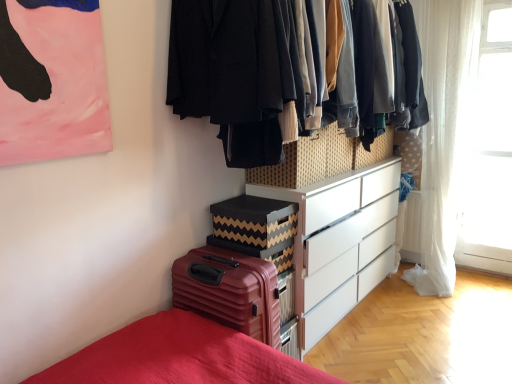
Locate an element on the screen. woven fabric drawer at center is located at coordinates (321, 158).

Find the location of `woven fabric drawer at center`. woven fabric drawer at center is located at coordinates (321, 158).

Which object is wider, textured fabric clothes at upper center or white matte chest of drawers at center?

textured fabric clothes at upper center.

Is textured fabric clothes at upper center next to white matte chest of drawers at center and touching it?

No, textured fabric clothes at upper center is not in contact with white matte chest of drawers at center.

How distant is textured fabric clothes at upper center from white matte chest of drawers at center?

A distance of 35.13 inches exists between textured fabric clothes at upper center and white matte chest of drawers at center.

Is white sheer curtain at right facing towards matte brown suitcase at lower left?

Yes, white sheer curtain at right is facing matte brown suitcase at lower left.

Does white sheer curtain at right have a smaller size compared to matte brown suitcase at lower left?

Incorrect, white sheer curtain at right is not smaller in size than matte brown suitcase at lower left.

Is white sheer curtain at right outside of matte brown suitcase at lower left?

Yes, white sheer curtain at right is located beyond the bounds of matte brown suitcase at lower left.

Who is taller, white sheer curtain at right or matte brown suitcase at lower left?

white sheer curtain at right.

Does point (271, 78) come behind point (446, 243)?

That is False.

Locate an element on the screen. The height and width of the screenshot is (384, 512). closet in front of the white sheer curtain at right is located at coordinates (234, 73).

How far apart are textured fabric clothes at upper center and white sheer curtain at right?

1.85 meters.

Which is in front, textured fabric clothes at upper center or white sheer curtain at right?

textured fabric clothes at upper center.

Looking at this image, from the image's perspective, which one is positioned higher, textured fabric clothes at upper center or white sheer curtain at right?

textured fabric clothes at upper center is shown above in the image.

In the scene shown: How many degrees apart are the facing directions of textured fabric clothes at upper center and white sheer curtain at right?

textured fabric clothes at upper center and white sheer curtain at right are facing 89.3 degrees away from each other.

Based on the photo, is textured fabric clothes at upper center oriented away from white sheer curtain at right?

No, white sheer curtain at right is not at the back of textured fabric clothes at upper center.

Is textured fabric clothes at upper center with woven fabric drawer at center?

There is a gap between textured fabric clothes at upper center and woven fabric drawer at center.

Identify the location of cabinetry directly beneath the textured fabric clothes at upper center (from a real-world perspective). (321, 158).

Considering the sizes of textured fabric clothes at upper center and woven fabric drawer at center in the image, is textured fabric clothes at upper center taller or shorter than woven fabric drawer at center?

In the image, textured fabric clothes at upper center appears to be taller than woven fabric drawer at center.

Would you say textured fabric clothes at upper center is outside woven fabric drawer at center?

Absolutely, textured fabric clothes at upper center is external to woven fabric drawer at center.

From the picture: Can you confirm if matte brown suitcase at lower left is positioned to the right of white matte chest of drawers at center?

Incorrect, matte brown suitcase at lower left is not on the right side of white matte chest of drawers at center.

In order to click on suitcase in front of the white matte chest of drawers at center in this screenshot , I will do 229,291.

Is matte brown suitcase at lower left positioned with its back to white matte chest of drawers at center?

That's not correct — matte brown suitcase at lower left is not looking away from white matte chest of drawers at center.

Which object is thinner, matte brown suitcase at lower left or white matte chest of drawers at center?

With smaller width is white matte chest of drawers at center.

Do you think matte brown suitcase at lower left is within white sheer curtain at right, or outside of it?

matte brown suitcase at lower left is outside white sheer curtain at right.

Which of these two, matte brown suitcase at lower left or white sheer curtain at right, stands taller?

white sheer curtain at right is taller.

From the image's perspective, is matte brown suitcase at lower left positioned above or below white sheer curtain at right?

Clearly, from the image's perspective, matte brown suitcase at lower left is below white sheer curtain at right.

Where is `closet above the white matte chest of drawers at center (from a real-world perspective)`? The width and height of the screenshot is (512, 384). closet above the white matte chest of drawers at center (from a real-world perspective) is located at coordinates (234, 73).

Identify the location of suitcase in front of the white sheer curtain at right. This screenshot has height=384, width=512. (229, 291).

When comparing their distances from white matte chest of drawers at center, does woven fabric drawer at center or white sheer curtain at right seem closer?

woven fabric drawer at center.

When comparing their distances from white sheer curtain at right, does woven fabric drawer at center or white sheer curtain at right seem closer?

white sheer curtain at right is positioned closer to the anchor white sheer curtain at right.

Looking at the image, which one is located closer to textured fabric clothes at upper center, woven fabric drawer at center or white matte chest of drawers at center?

woven fabric drawer at center.

Based on their spatial positions, is white sheer curtain at right or matte brown suitcase at lower left further from white sheer curtain at right?

matte brown suitcase at lower left is positioned further to the anchor white sheer curtain at right.

Which object lies further to the anchor point woven fabric drawer at center, matte brown suitcase at lower left or white sheer curtain at right?

Based on the image, white sheer curtain at right appears to be further to woven fabric drawer at center.

Based on their spatial positions, is textured fabric clothes at upper center or matte brown suitcase at lower left closer to white sheer curtain at right?

Based on the image, textured fabric clothes at upper center appears to be nearer to white sheer curtain at right.

Looking at the image, which one is located closer to white matte chest of drawers at center, white sheer curtain at right or matte brown suitcase at lower left?

matte brown suitcase at lower left lies closer to white matte chest of drawers at center than the other object.

From the image, which object appears to be farther from woven fabric drawer at center, white sheer curtain at right or white matte chest of drawers at center?

white sheer curtain at right is further to woven fabric drawer at center.

Find the location of a particular element. cabinetry between textured fabric clothes at upper center and white sheer curtain at right from front to back is located at coordinates (321, 158).

In order to click on closet between matte brown suitcase at lower left and white sheer curtain at right in this screenshot , I will do `click(234, 73)`.

Locate an element on the screen. closet between matte brown suitcase at lower left and white sheer curtain at right from left to right is located at coordinates (234, 73).

You are a GUI agent. You are given a task and a screenshot of the screen. Output one action in this format:
    pyautogui.click(x=<x>, y=<y>)
    Task: Click on the curtain situated between woven fabric drawer at center and white sheer curtain at right from left to right
    
    Given the screenshot: What is the action you would take?
    pyautogui.click(x=444, y=133)